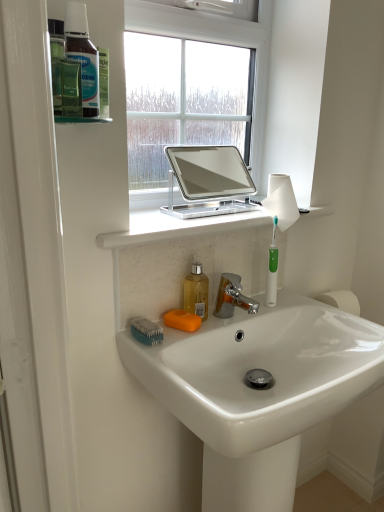
Question: In terms of height, does orange matte soap at sink look taller or shorter compared to white marble countertop at upper center?

Choices:
 (A) short
 (B) tall

Answer: (A)

Question: From a real-world perspective, is orange matte soap at sink positioned above or below white marble countertop at upper center?

Choices:
 (A) above
 (B) below

Answer: (B)

Question: Estimate the real-world distances between objects in this image. Which object is farther from the translucent yellow liquid at sink?

Choices:
 (A) translucent plastic bottles at upper left
 (B) teal plastic brush at lower left
 (C) white marble countertop at upper center
 (D) white glossy sink at center
 (E) green plastic toothbrush at right

Answer: (A)

Question: Which of these objects is positioned closest to the translucent yellow liquid at sink?

Choices:
 (A) green plastic toothbrush at right
 (B) translucent plastic bottles at upper left
 (C) orange matte soap at sink
 (D) white glossy sink at center
 (E) teal plastic brush at lower left

Answer: (C)